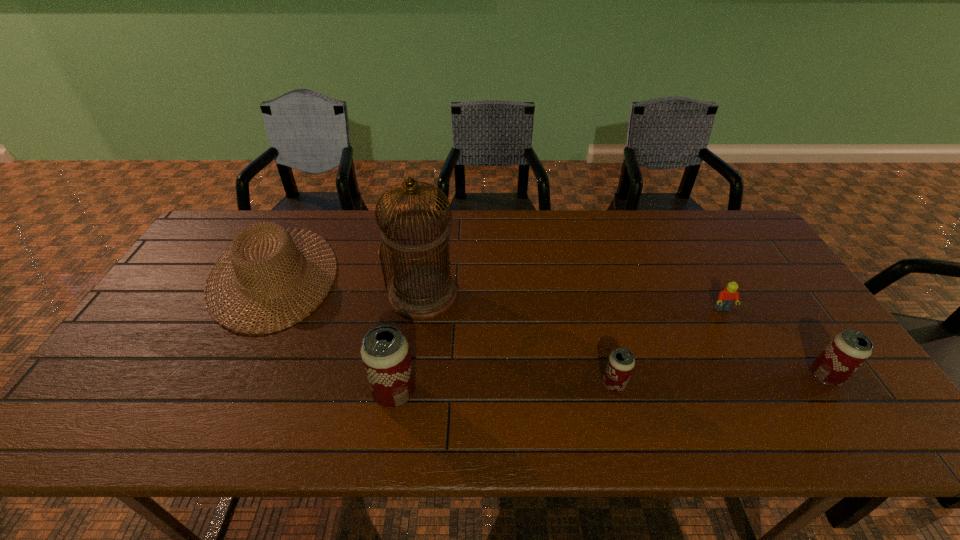
Find the location of a particular element. The width and height of the screenshot is (960, 540). blank space located 0.160m on the back of the fourth object from left to right is located at coordinates (598, 325).

Locate an element on the screen. vacant space located on the left of the rightmost object is located at coordinates (696, 376).

You are a GUI agent. You are given a task and a screenshot of the screen. Output one action in this format:
    pyautogui.click(x=<x>, y=<y>)
    Task: Click on the vacant point located 0.340m on the right of the sunhat
    
    Given the screenshot: What is the action you would take?
    pyautogui.click(x=449, y=275)

Identify the location of vacant space situated on the face of the Lego. The image size is (960, 540). (738, 340).

At what (x,y) coordinates should I click in order to perform the action: click on vacant region located on the front-facing side of the tallest object. Please return your answer as a coordinate pair (x, y). Looking at the image, I should click on (415, 359).

Identify the location of object at the far edge. (284, 239).

What are the coordinates of `object that is at the left edge` in the screenshot? It's located at (284, 239).

Find the location of a particular element. This screenshot has width=960, height=540. object at the right edge is located at coordinates point(847,351).

Find the location of `object that is at the far left corner`. object that is at the far left corner is located at coordinates (284, 239).

Locate an element on the screen. The height and width of the screenshot is (540, 960). object at the near right corner is located at coordinates (847, 351).